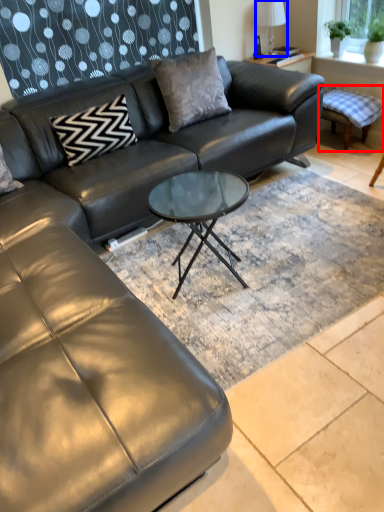
Question: Which point is closer to the camera, swivel chair (highlighted by a red box) or lamp (highlighted by a blue box)?

Choices:
 (A) swivel chair
 (B) lamp

Answer: (A)